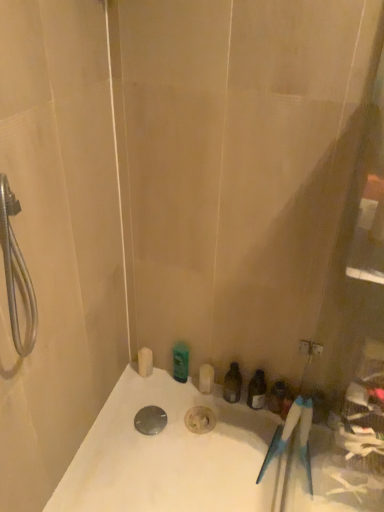
In order to click on vacant area that is in front of white matte soap dispenser at lower left, arranged as the 4th toiletry when viewed from the right in this screenshot , I will do `click(141, 407)`.